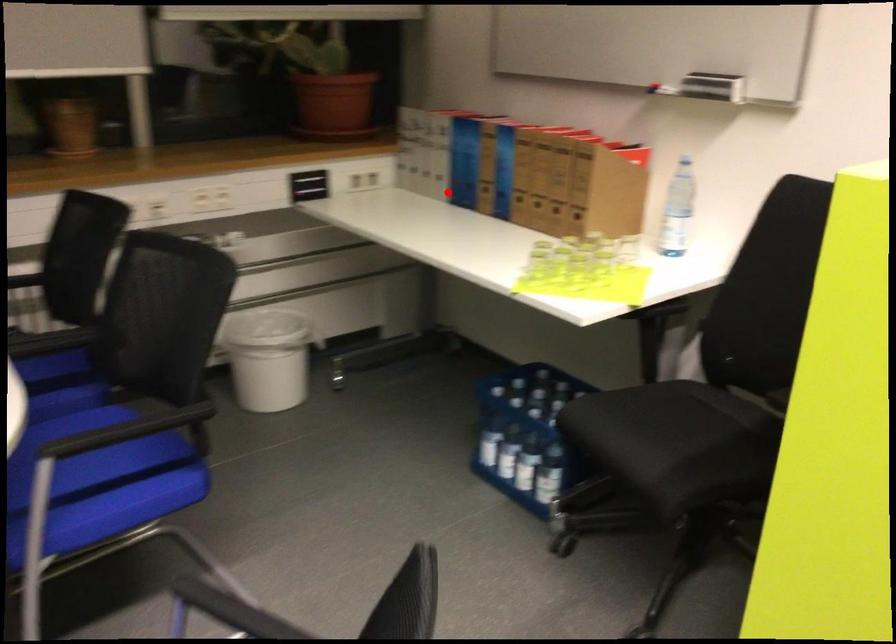
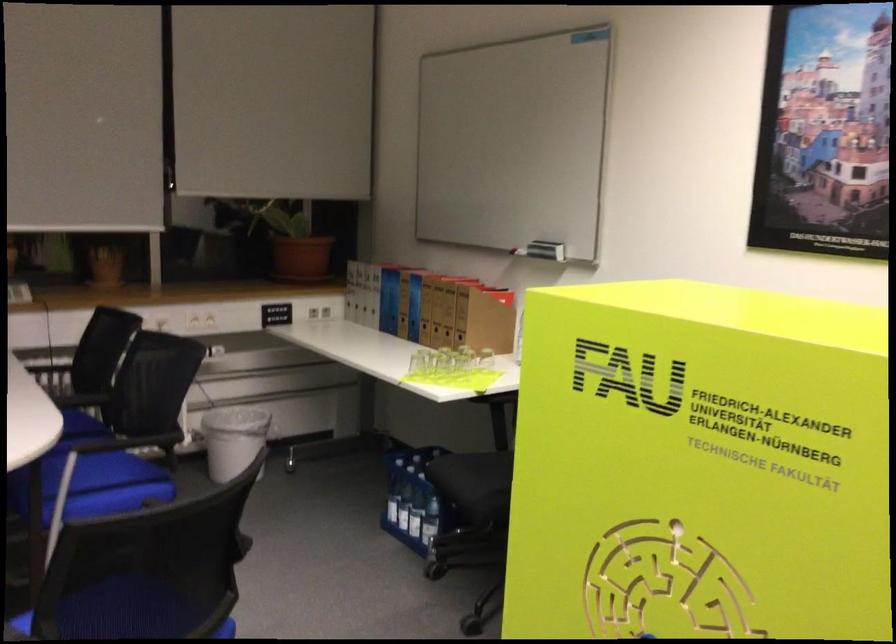
Question: I am providing you with two images of the same scene from different viewpoints. Given a red point in image1, look at the same physical point in image2. Is it:

Choices:
 (A) Closer to the viewpoint
 (B) Farther from the viewpoint

Answer: (B)